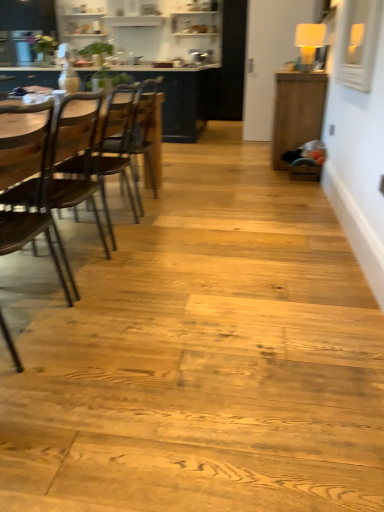
The width and height of the screenshot is (384, 512). Find the location of `wooden table at left, which is the 2th table from right to left`. wooden table at left, which is the 2th table from right to left is located at coordinates (184, 100).

I want to click on wooden chair at left, the 2th chair when ordered from front to back, so click(128, 138).

I want to click on wooden cabinet at right, placed as the 2th table when sorted from back to front, so click(296, 111).

Locate an element on the screen. wooden table at left, which is the 1th table from back to front is located at coordinates (184, 100).

From the image's perspective, which is above, wooden chair at left or wooden chair at left, the 2th chair when ordered from front to back?

wooden chair at left, the 2th chair when ordered from front to back, from the image's perspective.

Considering the positions of objects wooden chair at left and wooden chair at left, which ranks as the 1th chair in back-to-front order, in the image provided, who is in front, wooden chair at left or wooden chair at left, which ranks as the 1th chair in back-to-front order,?

wooden chair at left is closer to the camera.

Considering the points (54, 227) and (142, 85), which point is in front, point (54, 227) or point (142, 85)?

The point (54, 227) is in front.

At what (x,y) coordinates should I click in order to perform the action: click on chair above the wooden chair at left (from the image's perspective). Please return your answer as a coordinate pair (x, y). This screenshot has height=512, width=384. Looking at the image, I should click on (128, 138).

From a real-world perspective, is wooden chair at left, which ranks as the 1th chair in back-to-front order, over wooden chair at left?

Yes.

Considering the points (133, 127) and (61, 270), which point is in front, point (133, 127) or point (61, 270)?

Point (61, 270)

Based on their positions, is wooden chair at left, the 2th chair when ordered from front to back, located to the left or right of wooden chair at left?

Based on their positions, wooden chair at left, the 2th chair when ordered from front to back, is located to the right of wooden chair at left.

You are a GUI agent. You are given a task and a screenshot of the screen. Output one action in this format:
    pyautogui.click(x=<x>, y=<y>)
    Task: Click on the table on the left of the wooden chair at left, which appears as the 1th chair when viewed from the front
    The height and width of the screenshot is (512, 384).
    Given the screenshot: What is the action you would take?
    pyautogui.click(x=184, y=100)

From a real-world perspective, which object rests below the other?

wooden chair at left, arranged as the 2th chair when viewed from the back, is physically lower.

Is wooden chair at left, which appears as the 1th chair when viewed from the front, thinner than wooden table at left, acting as the first table starting from the left?

Yes, wooden chair at left, which appears as the 1th chair when viewed from the front, is thinner than wooden table at left, acting as the first table starting from the left.

Which of these two, wooden chair at left or wooden table at left, acting as the first table starting from the left, is wider?

Wider between the two is wooden chair at left.

Considering their positions, is wooden chair at left located in front of or behind wooden table at left, which is the 1th table from back to front?

In the image, wooden chair at left appears in front of wooden table at left, which is the 1th table from back to front.

Find the location of a particular element. The image size is (384, 512). armchair below the wooden table at left, which is counted as the 2th table, starting from the front (from a real-world perspective) is located at coordinates (44, 184).

Is wooden table at left, acting as the first table starting from the left, shorter than wooden chair at left, which ranks as the 1th chair in back-to-front order?

In fact, wooden table at left, acting as the first table starting from the left, may be taller than wooden chair at left, which ranks as the 1th chair in back-to-front order.

Is wooden table at left, which is counted as the 2th table, starting from the front, facing away from wooden chair at left, which ranks as the 1th chair in back-to-front order?

No, wooden chair at left, which ranks as the 1th chair in back-to-front order, is not at the back of wooden table at left, which is counted as the 2th table, starting from the front.

From a real-world perspective, is wooden table at left, which is counted as the 2th table, starting from the front, positioned under wooden chair at left, which ranks as the 1th chair in back-to-front order, based on gravity?

No, from a real-world perspective, wooden table at left, which is counted as the 2th table, starting from the front, is not below wooden chair at left, which ranks as the 1th chair in back-to-front order.

Does point (205, 102) come in front of point (99, 151)?

No, (205, 102) is further to viewer.

Can you confirm if wooden cabinet at right, which is counted as the first table, starting from the right, is thinner than wooden table at left, which is the 1th table from back to front?

Indeed, wooden cabinet at right, which is counted as the first table, starting from the right, has a lesser width compared to wooden table at left, which is the 1th table from back to front.

Considering the sizes of objects wooden cabinet at right, acting as the second table starting from the left, and wooden table at left, which is counted as the 2th table, starting from the front, in the image provided, who is smaller, wooden cabinet at right, acting as the second table starting from the left, or wooden table at left, which is counted as the 2th table, starting from the front,?

With smaller size is wooden cabinet at right, acting as the second table starting from the left.

Would you consider wooden cabinet at right, placed as the 2th table when sorted from back to front, to be distant from wooden table at left, which is the 2th table from right to left?

Absolutely, wooden cabinet at right, placed as the 2th table when sorted from back to front, is distant from wooden table at left, which is the 2th table from right to left.

Is wooden cabinet at right, which is counted as the first table, starting from the right, turned away from wooden table at left, acting as the first table starting from the left?

That's not correct — wooden cabinet at right, which is counted as the first table, starting from the right, is not looking away from wooden table at left, acting as the first table starting from the left.

Considering the relative positions of wooden cabinet at right, acting as the second table starting from the left, and wooden chair at left in the image provided, is wooden cabinet at right, acting as the second table starting from the left, to the left or to the right of wooden chair at left?

In the image, wooden cabinet at right, acting as the second table starting from the left, appears on the right side of wooden chair at left.

Is wooden cabinet at right, placed as the 2th table when sorted from back to front, behind wooden chair at left?

Yes, it is.

Are wooden cabinet at right, the 1th table in the front-to-back sequence, and wooden chair at left making contact?

wooden cabinet at right, the 1th table in the front-to-back sequence, is not next to wooden chair at left, and they're not touching.

Considering the sizes of wooden cabinet at right, which is counted as the first table, starting from the right, and wooden chair at left in the image, is wooden cabinet at right, which is counted as the first table, starting from the right, bigger or smaller than wooden chair at left?

wooden cabinet at right, which is counted as the first table, starting from the right, is smaller than wooden chair at left.

Find the location of a particular element. This screenshot has height=512, width=384. armchair below the wooden chair at left, the 2th chair when ordered from front to back (from the image's perspective) is located at coordinates (44, 184).

I want to click on the 1st chair above the wooden chair at left (from a real-world perspective), so click(128, 138).

When comparing their distances from wooden table at left, which is counted as the 2th table, starting from the front, does wooden chair at left, arranged as the 2th chair when viewed from the back, or wooden chair at left seem further?

The object further to wooden table at left, which is counted as the 2th table, starting from the front, is wooden chair at left.

When comparing their distances from wooden table at left, acting as the first table starting from the left, does wooden chair at left, the 2th chair when ordered from front to back, or wooden chair at left seem closer?

Among the two, wooden chair at left, the 2th chair when ordered from front to back, is located nearer to wooden table at left, acting as the first table starting from the left.

Based on the photo, which object lies further to the anchor point wooden table at left, acting as the first table starting from the left, wooden cabinet at right, the 1th table in the front-to-back sequence, or wooden chair at left?

The object further to wooden table at left, acting as the first table starting from the left, is wooden chair at left.

Based on the photo, considering their positions, is wooden table at left, which is the 1th table from back to front, positioned further to wooden chair at left than wooden cabinet at right, acting as the second table starting from the left?

wooden table at left, which is the 1th table from back to front, is further to wooden chair at left.

Considering their positions, is wooden chair at left, arranged as the 2th chair when viewed from the back, positioned closer to wooden cabinet at right, which is counted as the first table, starting from the right, than wooden table at left, which is counted as the 2th table, starting from the front?

wooden table at left, which is counted as the 2th table, starting from the front, is positioned closer to the anchor wooden cabinet at right, which is counted as the first table, starting from the right.

Based on the photo, considering their positions, is wooden cabinet at right, which is counted as the first table, starting from the right, positioned further to wooden chair at left than wooden chair at left, the 2th chair when ordered from front to back?

wooden cabinet at right, which is counted as the first table, starting from the right, is positioned further to the anchor wooden chair at left.

In the scene shown: Which object lies further to the anchor point wooden cabinet at right, acting as the second table starting from the left, wooden table at left, which is counted as the 2th table, starting from the front, or wooden chair at left, the 2th chair when ordered from front to back?

wooden table at left, which is counted as the 2th table, starting from the front.

From the image, which object appears to be farther from wooden chair at left, the 2th chair when ordered from front to back, wooden cabinet at right, placed as the 2th table when sorted from back to front, or wooden chair at left?

Based on the image, wooden cabinet at right, placed as the 2th table when sorted from back to front, appears to be further to wooden chair at left, the 2th chair when ordered from front to back.

Locate an element on the screen. chair positioned between wooden chair at left, arranged as the 2th chair when viewed from the back, and wooden table at left, which is the 2th table from right to left, from near to far is located at coordinates (128, 138).

Locate an element on the screen. table positioned between wooden chair at left and wooden table at left, acting as the first table starting from the left, from near to far is located at coordinates (296, 111).

Locate an element on the screen. This screenshot has width=384, height=512. table positioned between wooden chair at left, the 2th chair when ordered from front to back, and wooden table at left, acting as the first table starting from the left, from near to far is located at coordinates tap(296, 111).

Where is `chair between wooden chair at left, which appears as the 1th chair when viewed from the front, and wooden cabinet at right, which is counted as the first table, starting from the right, from front to back`? chair between wooden chair at left, which appears as the 1th chair when viewed from the front, and wooden cabinet at right, which is counted as the first table, starting from the right, from front to back is located at coordinates (128, 138).